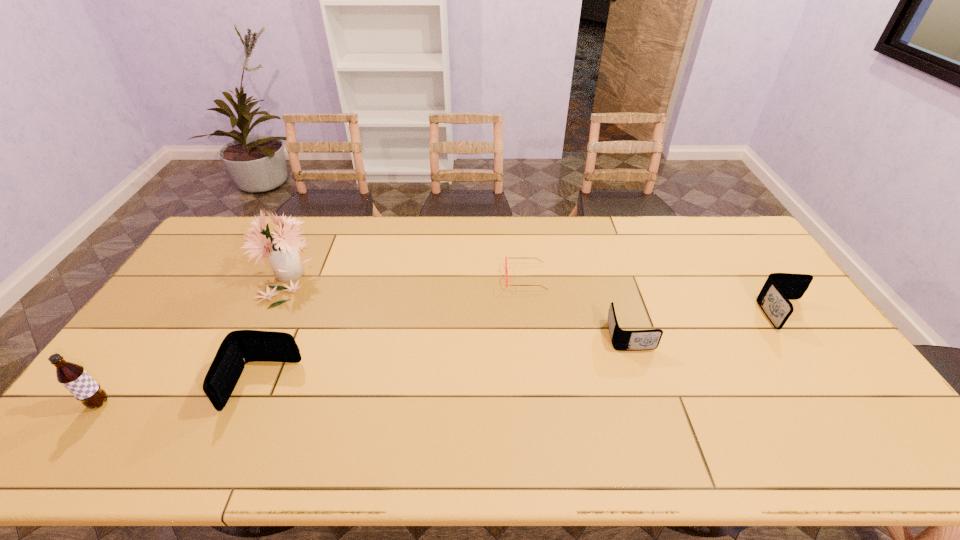
Identify which object is located as the fifth nearest to the rightmost wallet. Please provide its 2D coordinates. Your answer should be formatted as a tuple, i.e. [(x, y)], where the tuple contains the x and y coordinates of a point satisfying the conditions above.

[(73, 377)]

Locate which wallet is the closest to the leftmost wallet. Please provide its 2D coordinates. Your answer should be formatted as a tuple, i.e. [(x, y)], where the tuple contains the x and y coordinates of a point satisfying the conditions above.

[(622, 340)]

What are the coordinates of `wallet that can be found as the closest to the shortest wallet` in the screenshot? It's located at (779, 288).

Identify the location of free space that satisfies the following two spatial constraints: 1. on the outer surface of the shortest wallet; 2. on the outer surface of the nearest wallet. (646, 386).

Locate an element on the screen. Image resolution: width=960 pixels, height=540 pixels. vacant area that satisfies the following two spatial constraints: 1. on the outer surface of the second shortest object; 2. on the outer surface of the leftmost wallet is located at coordinates (646, 386).